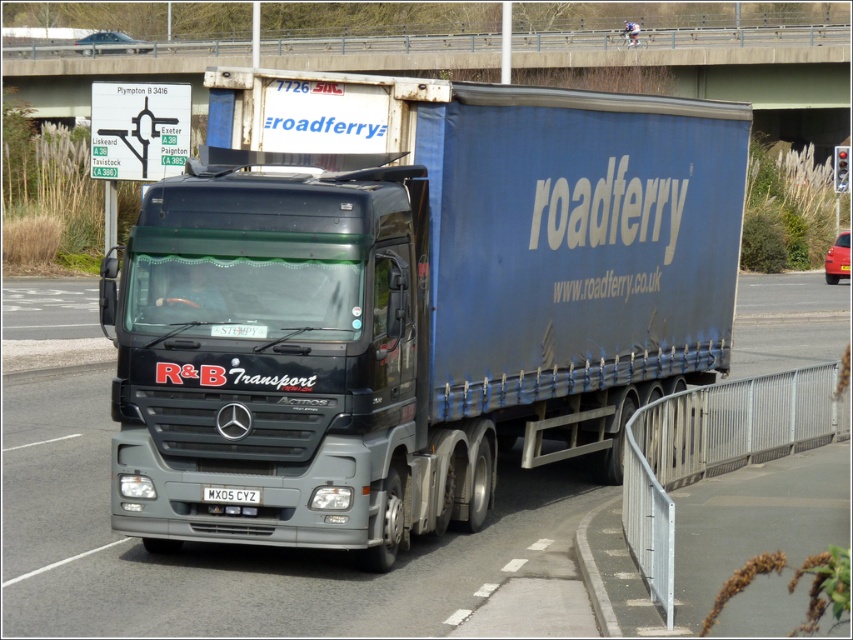
Is metallic blue trailer truck at center further to the viewer compared to metallic gray truck at center?

Yes, metallic blue trailer truck at center is further from the viewer.

Between point (265, 214) and point (39, 545), which one is positioned in front?

Positioned in front is point (265, 214).

Locate an element on the screen. This screenshot has width=853, height=640. metallic blue trailer truck at center is located at coordinates (410, 301).

Between metallic gray truck at center and white rectangular license plate at center, which one appears on the left side from the viewer's perspective?

white rectangular license plate at center

Which is more to the right, metallic gray truck at center or white rectangular license plate at center?

metallic gray truck at center is more to the right.

Measure the distance between point (x=178, y=628) and camera.

They are 27.77 feet apart.

I want to click on metallic gray truck at center, so click(x=212, y=547).

Who is shorter, metallic blue trailer truck at center or white rectangular license plate at center?

white rectangular license plate at center

Is point (680, 278) positioned in front of point (238, 496)?

No.

Locate an element on the screen. This screenshot has width=853, height=640. metallic blue trailer truck at center is located at coordinates (410, 301).